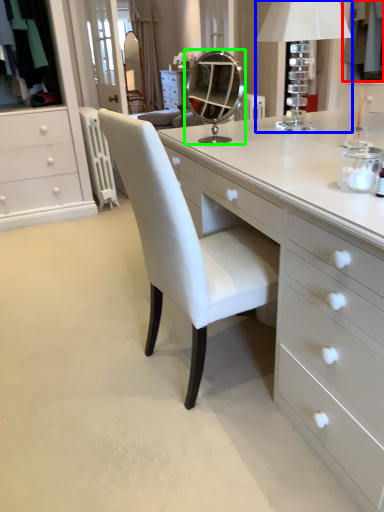
Question: Considering the real-world distances, which object is closest to clothing (highlighted by a red box)? table lamp (highlighted by a blue box) or mirror (highlighted by a green box).

Choices:
 (A) table lamp
 (B) mirror

Answer: (A)